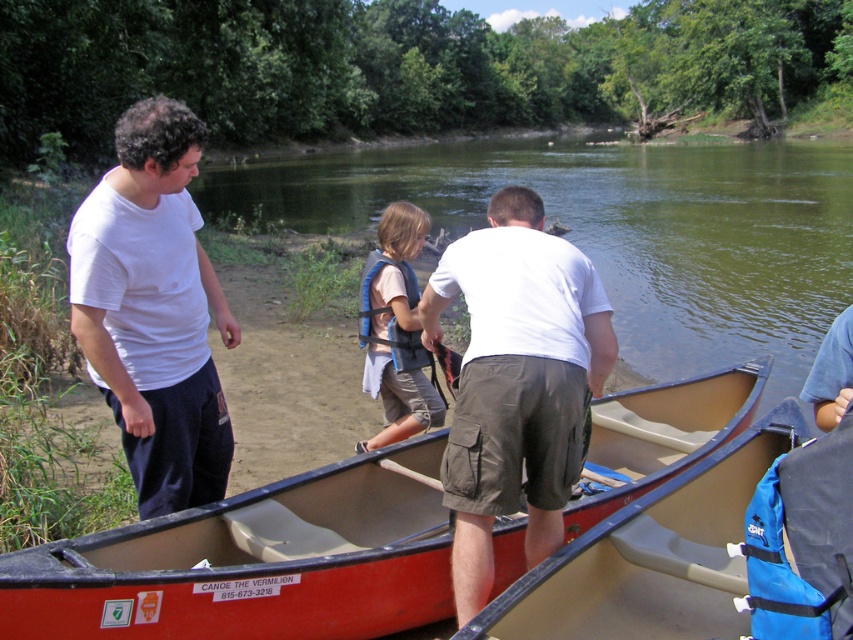
Question: Estimate the real-world distances between objects in this image. Which object is closer to the white matte shirt at center?

Choices:
 (A) red plastic canoe at center
 (B) green water at center
 (C) blue fabric life vest at center
 (D) white matte t-shirt at left

Answer: (A)

Question: Can you confirm if white matte shirt at center is positioned to the right of white matte t-shirt at left?

Choices:
 (A) no
 (B) yes

Answer: (B)

Question: Which point appears closest to the camera in this image?

Choices:
 (A) (782, 141)
 (B) (517, 492)
 (C) (397, 336)
 (D) (410, 584)

Answer: (B)

Question: Does green water at center come behind white matte t-shirt at left?

Choices:
 (A) no
 (B) yes

Answer: (B)

Question: Which point appears closest to the camera in this image?

Choices:
 (A) (463, 317)
 (B) (397, 256)

Answer: (B)

Question: Does white matte t-shirt at left appear over blue fabric life vest at center?

Choices:
 (A) no
 (B) yes

Answer: (B)